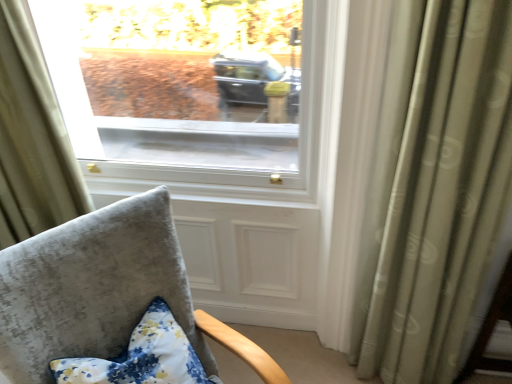
Question: Does silky green curtain at right, which is the 1th curtain from right to left, have a larger size compared to floral fabric pillow at lower left?

Choices:
 (A) no
 (B) yes

Answer: (B)

Question: Can you confirm if silky green curtain at right, which is the 1th curtain from right to left, is taller than floral fabric pillow at lower left?

Choices:
 (A) yes
 (B) no

Answer: (A)

Question: Can you confirm if silky green curtain at right, which is the 2th curtain from left to right, is shorter than floral fabric pillow at lower left?

Choices:
 (A) yes
 (B) no

Answer: (B)

Question: Is floral fabric pillow at lower left at the back of silky green curtain at right, which is the 2th curtain from left to right?

Choices:
 (A) yes
 (B) no

Answer: (B)

Question: Is silky green curtain at right, which is the 2th curtain from left to right, positioned far away from floral fabric pillow at lower left?

Choices:
 (A) yes
 (B) no

Answer: (B)

Question: Is point click(169, 345) positioned closer to the camera than point click(429, 56)?

Choices:
 (A) farther
 (B) closer

Answer: (A)

Question: Considering the positions of floral fabric pillow at lower left and silky green curtain at right, which is the 1th curtain from right to left, in the image, is floral fabric pillow at lower left wider or thinner than silky green curtain at right, which is the 1th curtain from right to left,?

Choices:
 (A) wide
 (B) thin

Answer: (A)

Question: From the image's perspective, is floral fabric pillow at lower left above or below silky green curtain at right, which is the 1th curtain from right to left?

Choices:
 (A) above
 (B) below

Answer: (B)

Question: In terms of size, does floral fabric pillow at lower left appear bigger or smaller than silky green curtain at right, which is the 2th curtain from left to right?

Choices:
 (A) big
 (B) small

Answer: (B)

Question: From the image's perspective, relative to floral fabric pillow at lower left, is velvet gray chair at lower left above or below?

Choices:
 (A) above
 (B) below

Answer: (B)

Question: In the image, is velvet gray chair at lower left on the left side or the right side of floral fabric pillow at lower left?

Choices:
 (A) left
 (B) right

Answer: (B)

Question: Is velvet gray chair at lower left in front of or behind floral fabric pillow at lower left in the image?

Choices:
 (A) behind
 (B) front

Answer: (B)

Question: Does point (71, 309) appear closer or farther from the camera than point (152, 352)?

Choices:
 (A) farther
 (B) closer

Answer: (B)

Question: Based on their sizes in the image, would you say velvet gray chair at lower left is bigger or smaller than light beige fabric curtain at upper left, which ranks as the second curtain in right-to-left order?

Choices:
 (A) big
 (B) small

Answer: (A)

Question: In terms of width, does velvet gray chair at lower left look wider or thinner when compared to light beige fabric curtain at upper left, which ranks as the second curtain in right-to-left order?

Choices:
 (A) wide
 (B) thin

Answer: (A)